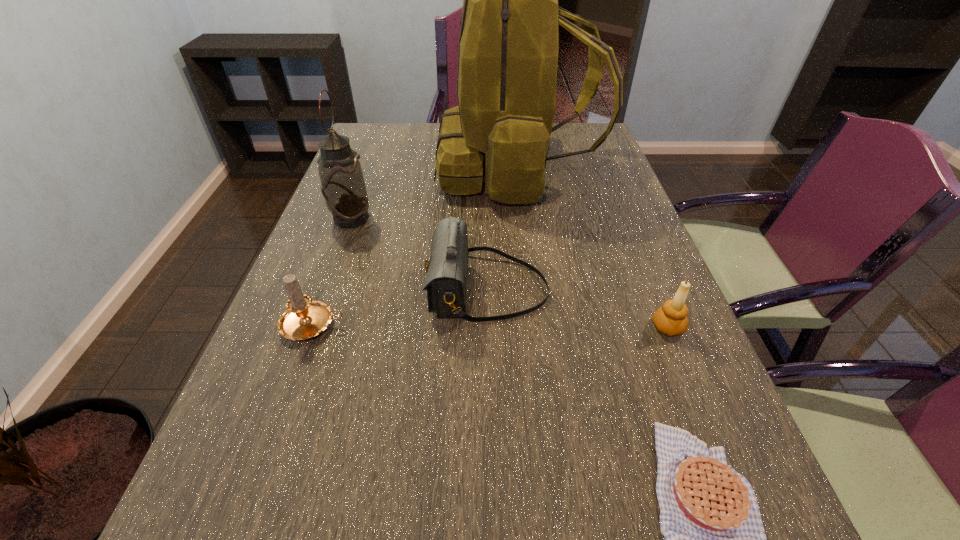
Find the location of `free point located on the right of the candle`. free point located on the right of the candle is located at coordinates coord(502,325).

This screenshot has width=960, height=540. Find the location of `free space located 0.310m on the front of the candle_holder`. free space located 0.310m on the front of the candle_holder is located at coordinates (738, 501).

This screenshot has width=960, height=540. I want to click on object that is at the far edge, so click(508, 48).

Identify the location of oil lamp at the left edge. This screenshot has width=960, height=540. (342, 185).

The width and height of the screenshot is (960, 540). I want to click on candle present at the left edge, so click(x=303, y=319).

This screenshot has width=960, height=540. What are the coordinates of `backpack that is at the right edge` in the screenshot? It's located at (508, 48).

Find the location of a particular element. The width and height of the screenshot is (960, 540). candle_holder that is at the right edge is located at coordinates (670, 319).

The image size is (960, 540). What are the coordinates of `object situated at the far right corner` in the screenshot? It's located at (508, 48).

The height and width of the screenshot is (540, 960). What are the coordinates of `vacant space at the far edge` in the screenshot? It's located at (420, 130).

Identify the location of vacant space at the near edge of the desktop. The height and width of the screenshot is (540, 960). (500, 538).